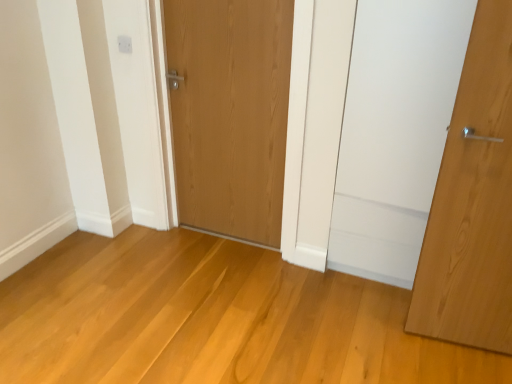
Question: Considering the relative positions of wooden door at center, which is the second door from right to left, and white plastic electric outlet at upper center in the image provided, is wooden door at center, which is the second door from right to left, to the left or to the right of white plastic electric outlet at upper center?

Choices:
 (A) right
 (B) left

Answer: (A)

Question: Is point (202, 172) positioned closer to the camera than point (126, 38)?

Choices:
 (A) closer
 (B) farther

Answer: (B)

Question: Which object is the closest to the wooden door at center, which ranks as the 1th door in left-to-right order?

Choices:
 (A) natural wood door at right, positioned as the 1th door in front-to-back order
 (B) white plastic electric outlet at upper center

Answer: (B)

Question: Estimate the real-world distances between objects in this image. Which object is farther from the natural wood door at right, positioned as the 1th door in front-to-back order?

Choices:
 (A) white plastic electric outlet at upper center
 (B) wooden door at center, which is counted as the first door, starting from the back

Answer: (A)